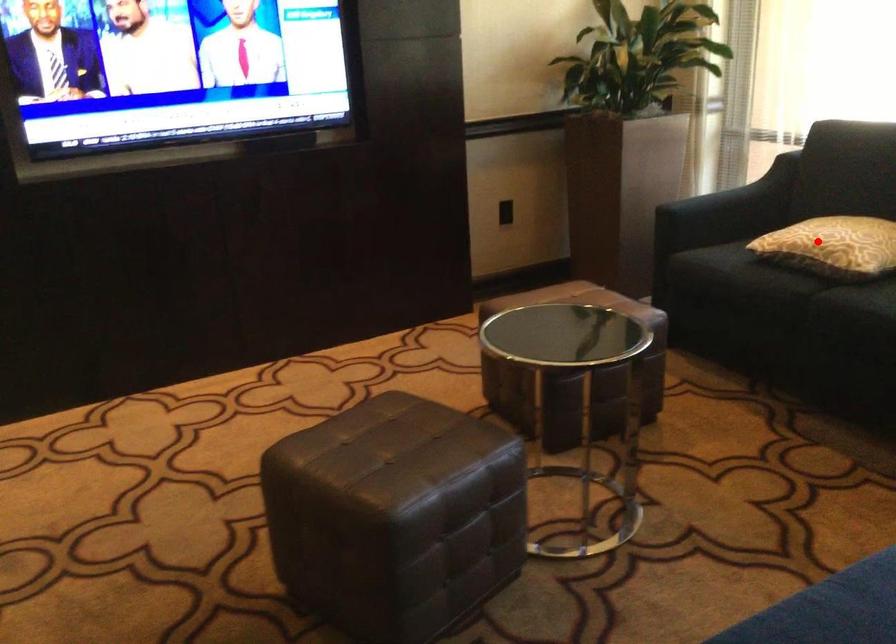
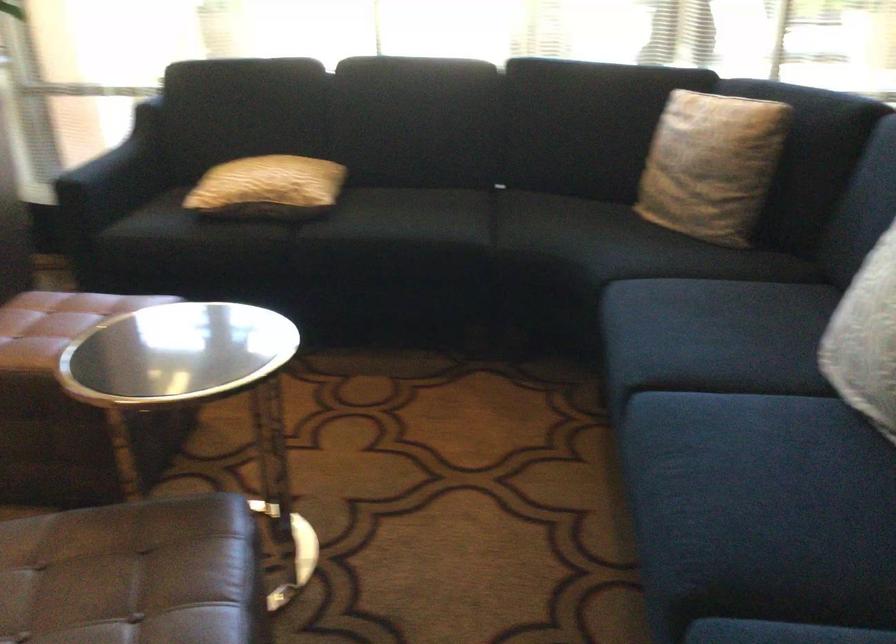
The point at the highlighted location is marked in the first image. Where is the corresponding point in the second image?

(268, 187)